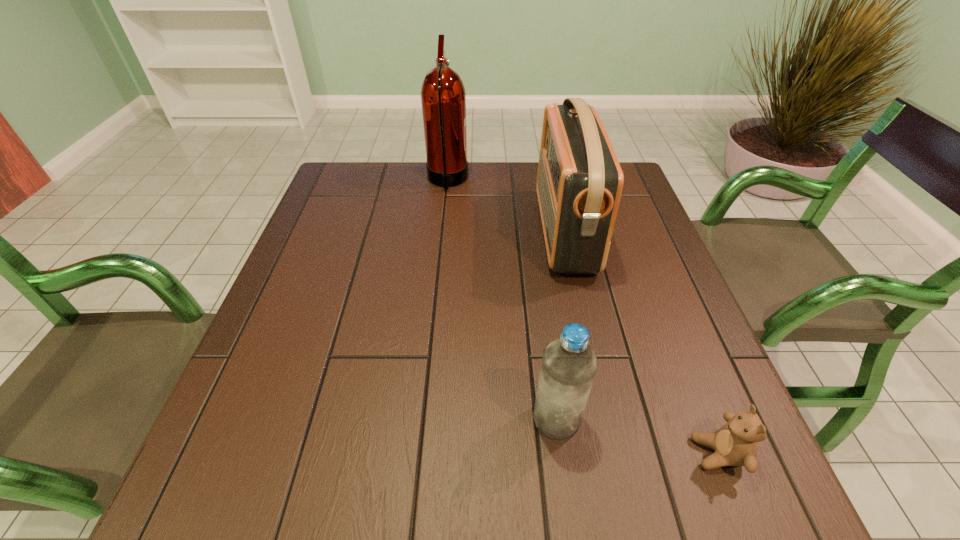
You are a GUI agent. You are given a task and a screenshot of the screen. Output one action in this format:
    pyautogui.click(x=<x>, y=<y>)
    Task: Click on the leftmost object
    This screenshot has width=960, height=540.
    Given the screenshot: What is the action you would take?
    [443, 97]

At what (x,y) coordinates should I click in order to perform the action: click on fire extinguisher. Please return your answer as a coordinate pair (x, y). Looking at the image, I should click on (443, 97).

Where is `radio receiver`? Image resolution: width=960 pixels, height=540 pixels. radio receiver is located at coordinates (579, 184).

The height and width of the screenshot is (540, 960). Identify the location of water bottle. [569, 364].

Where is `teddy bear`? The width and height of the screenshot is (960, 540). teddy bear is located at coordinates (735, 444).

Find the location of `the shortest object`. the shortest object is located at coordinates (735, 444).

Identify the location of vacant space located 0.320m on the front-facing side of the leftmost object. (575, 181).

This screenshot has height=540, width=960. What are the coordinates of `vacant space located 0.260m on the front-facing side of the radio receiver` in the screenshot? It's located at (441, 231).

You are a GUI agent. You are given a task and a screenshot of the screen. Output one action in this format:
    pyautogui.click(x=<x>, y=<y>)
    Task: Click on the vacant position located 0.200m on the front-facing side of the radio receiver
    This screenshot has width=960, height=540.
    Given the screenshot: What is the action you would take?
    pyautogui.click(x=464, y=231)

Identify the location of blank space located on the front-facing side of the radio receiver. pyautogui.click(x=410, y=231).